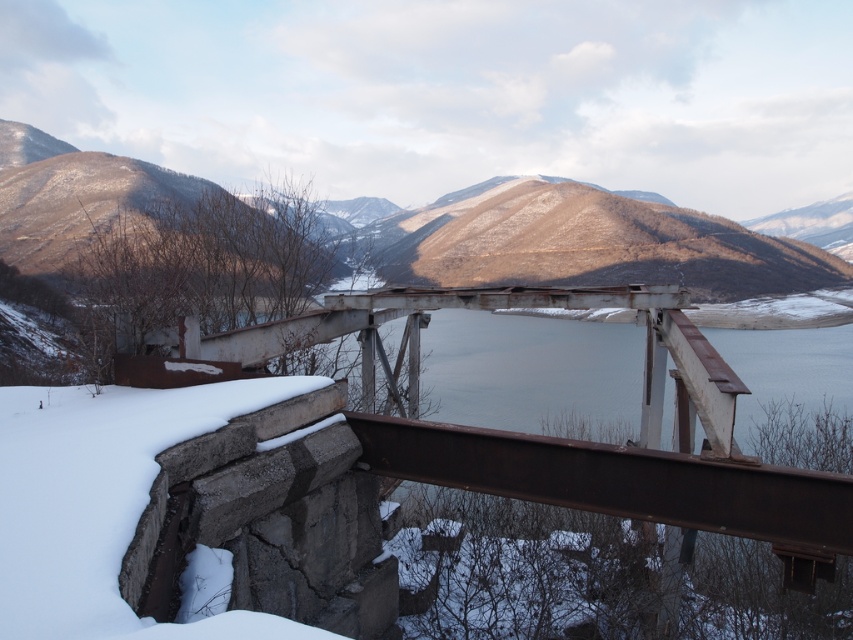
Consider the image. You are a hiker planning to cross the rusty metal bridge at center to reach the brown textured mountain at center. Based on the scene, can you safely walk across the bridge to get to the mountain?

The rusty metal bridge at center is in front of the brown textured mountain at center, meaning the bridge is between you and the mountain. However, the bridge is described as partially collapsed with rusted metal beams and concrete remnants covered in snow, indicating it is unsafe to walk across. Therefore, you cannot safely cross the bridge to reach the mountain.

You are an engineer assessing the structural integrity of the rusty metal bridge at center and the brown textured mountain at center. Which of the two occupies more area in the image?

The brown textured mountain at center occupies more area than the rusty metal bridge at center in the image.